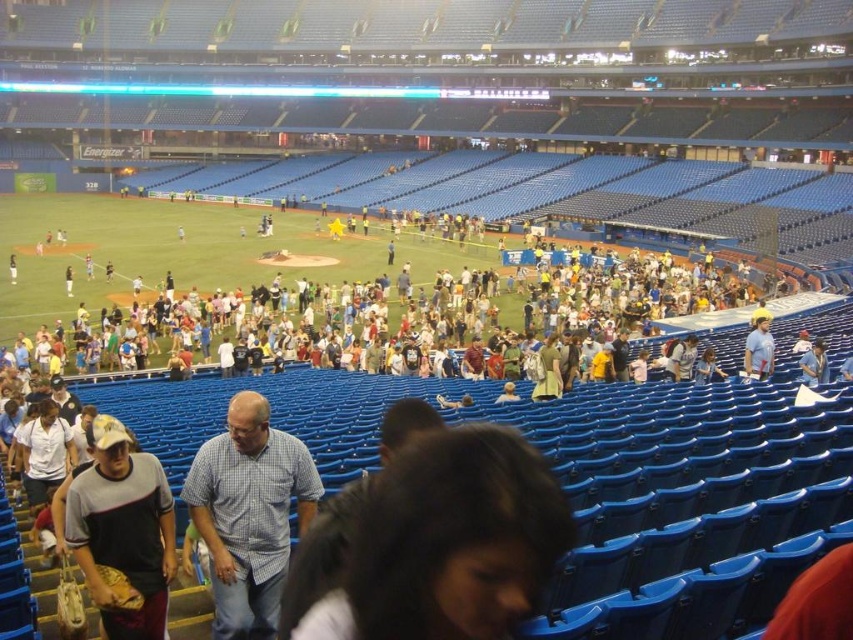
Question: Which object appears closest to the camera in this image?

Choices:
 (A) checkered fabric shirt at center
 (B) light blue shirt at lower right
 (C) light blue shirt at right

Answer: (A)

Question: Estimate the real-world distances between objects in this image. Which object is farther from the checkered fabric shirt at center?

Choices:
 (A) light blue shirt at right
 (B) light blue shirt at lower right
 (C) dark brown hair at center
 (D) gray cotton t-shirt at lower left

Answer: (A)

Question: Considering the relative positions of dark brown hair at center and light blue shirt at lower right in the image provided, where is dark brown hair at center located with respect to light blue shirt at lower right?

Choices:
 (A) right
 (B) left

Answer: (B)

Question: Which of the following is the closest to the observer?

Choices:
 (A) (140, 492)
 (B) (757, 316)
 (C) (824, 369)
 (D) (550, 483)

Answer: (D)

Question: Where is gray cotton t-shirt at lower left located in relation to light blue shirt at right in the image?

Choices:
 (A) left
 (B) right

Answer: (A)

Question: Can you confirm if checkered fabric shirt at center is smaller than light blue shirt at right?

Choices:
 (A) no
 (B) yes

Answer: (B)